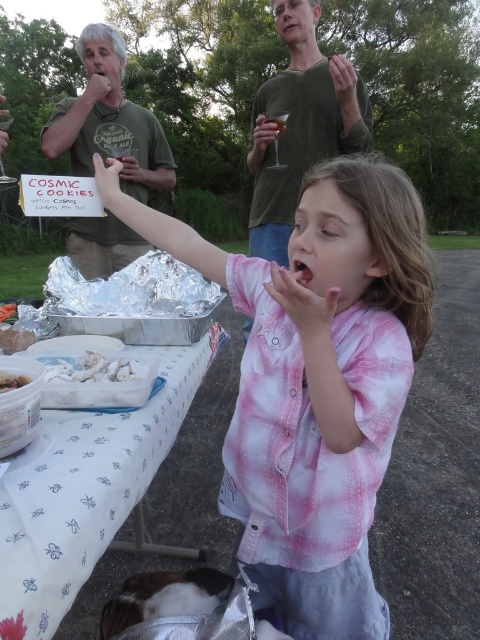
You are at a picnic and see two white crumbly items. The white crumbly cake at center and the white crumbly food at upper left. Which one is bigger?

The white crumbly cake at center is larger in size than the white crumbly food at upper left.